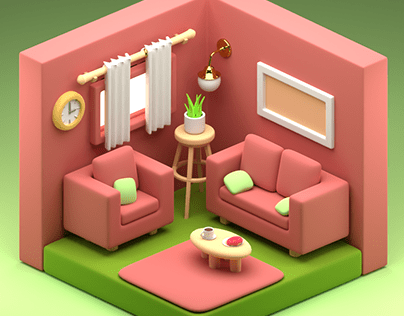
Where is `green floor`? The width and height of the screenshot is (404, 316). green floor is located at coordinates (297, 270).